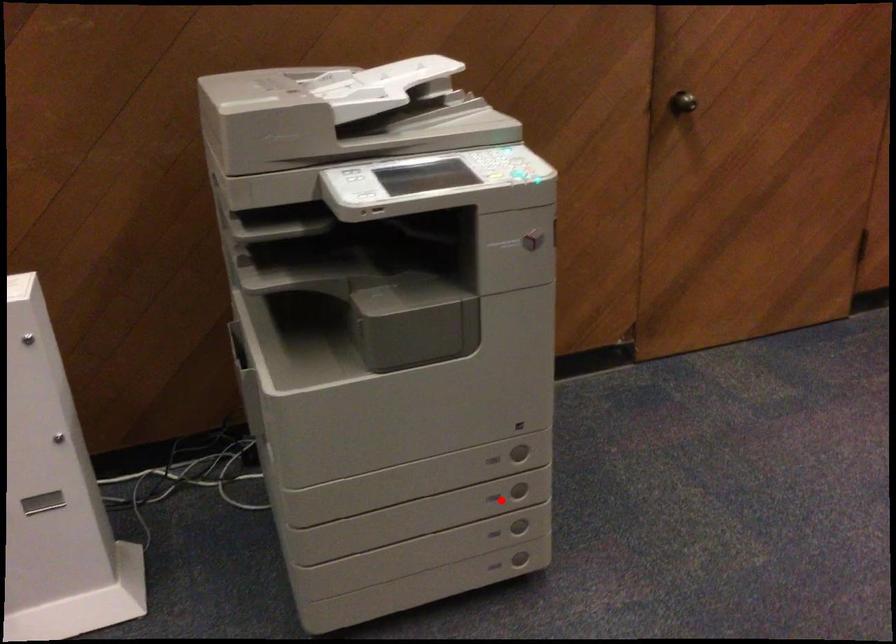
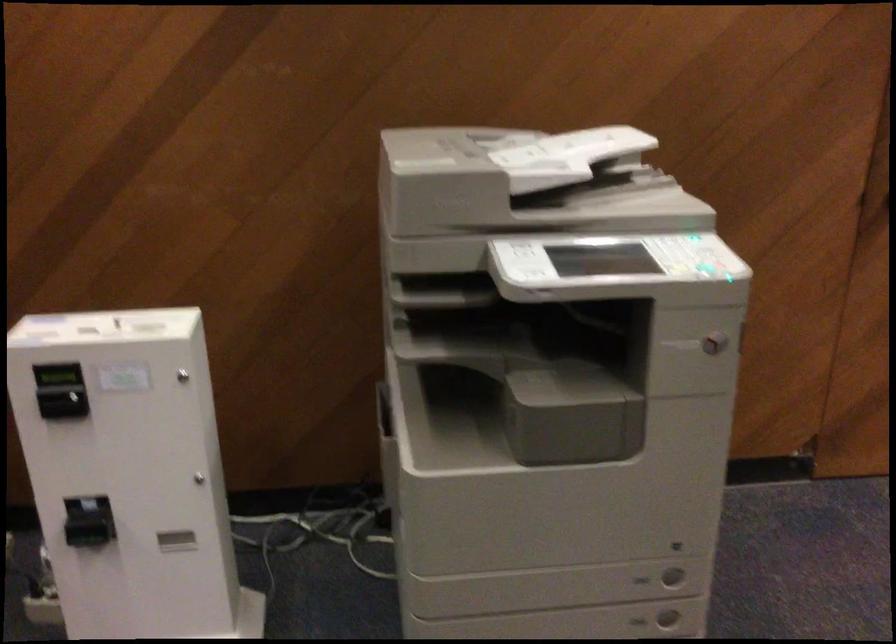
Where in the second image is the point corresponding to the highlighted location from the first image?

(638, 621)